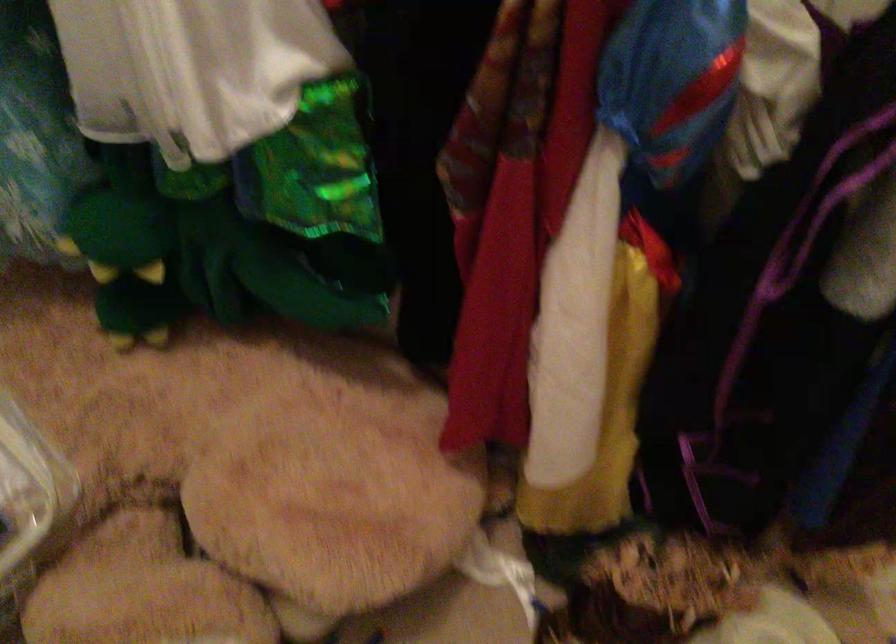
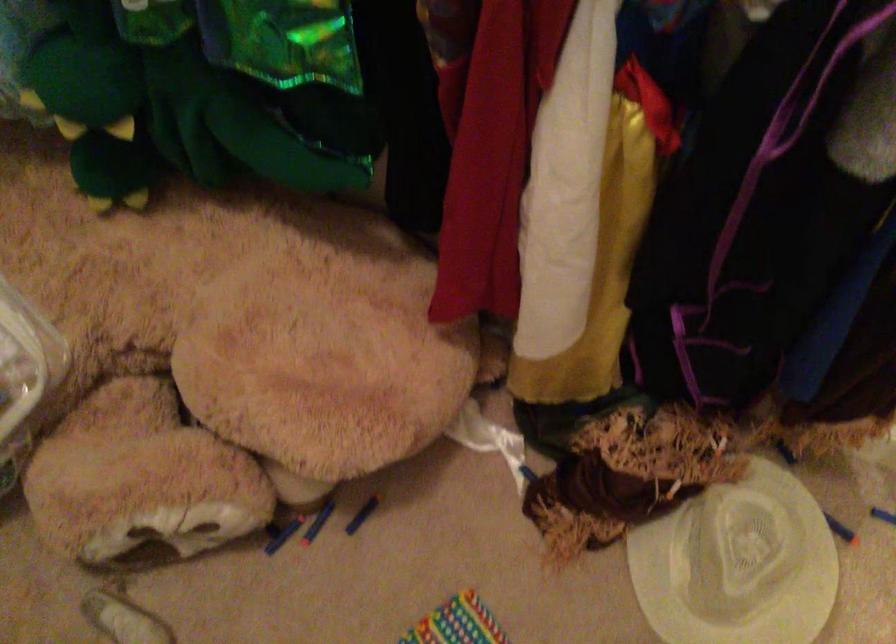
The point at (263, 453) is marked in the first image. Where is the corresponding point in the second image?

(247, 321)